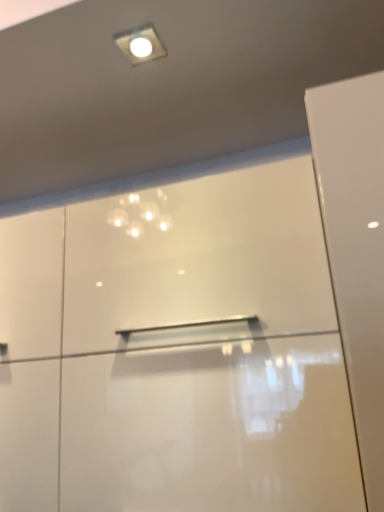
Where is `glossy white dresser at center`? glossy white dresser at center is located at coordinates (175, 352).

Image resolution: width=384 pixels, height=512 pixels. What do you see at coordinates (175, 352) in the screenshot? I see `glossy white dresser at center` at bounding box center [175, 352].

Image resolution: width=384 pixels, height=512 pixels. What do you see at coordinates (140, 44) in the screenshot? I see `white glossy droplight at upper center` at bounding box center [140, 44].

Measure the distance between point (x=133, y=33) and camera.

Point (x=133, y=33) and camera are 35.91 inches apart from each other.

Identify the location of white glossy droplight at upper center. [x=140, y=44].

Find the location of a particular element. The image size is (384, 512). glossy white dresser at center is located at coordinates (175, 352).

Is white glossy droplight at upper center to the right of glossy white dresser at center from the viewer's perspective?

Yes, white glossy droplight at upper center is to the right of glossy white dresser at center.

In the scene shown: Is white glossy droplight at upper center positioned in front of glossy white dresser at center?

No, it is behind glossy white dresser at center.

Based on the photo, which point is more forward, (137, 50) or (183, 377)?

The point (183, 377) is in front.

From the image's perspective, relative to glossy white dresser at center, is white glossy droplight at upper center above or below?

Clearly, from the image's perspective, white glossy droplight at upper center is above glossy white dresser at center.

From a real-world perspective, who is located higher, white glossy droplight at upper center or glossy white dresser at center?

white glossy droplight at upper center, from a real-world perspective.

Between white glossy droplight at upper center and glossy white dresser at center, which one has smaller width?

With smaller width is white glossy droplight at upper center.

Is white glossy droplight at upper center taller or shorter than glossy white dresser at center?

In the image, white glossy droplight at upper center appears to be shorter than glossy white dresser at center.

Between white glossy droplight at upper center and glossy white dresser at center, which one has larger size?

glossy white dresser at center.

Would you say white glossy droplight at upper center contains glossy white dresser at center?

No, glossy white dresser at center is not surrounded by white glossy droplight at upper center.

Is white glossy droplight at upper center in contact with glossy white dresser at center?

No, white glossy droplight at upper center is not next to glossy white dresser at center.

Could you tell me if white glossy droplight at upper center is facing glossy white dresser at center?

No, white glossy droplight at upper center is not oriented towards glossy white dresser at center.

This screenshot has width=384, height=512. I want to click on dresser to the left of white glossy droplight at upper center, so click(x=175, y=352).

Can you confirm if glossy white dresser at center is positioned to the right of white glossy droplight at upper center?

No.

Is the depth of glossy white dresser at center greater than that of white glossy droplight at upper center?

That is False.

Which is behind, point (319, 404) or point (149, 41)?

Positioned behind is point (149, 41).

From the image's perspective, is glossy white dresser at center positioned above or below white glossy droplight at upper center?

From the image's perspective, glossy white dresser at center appears below white glossy droplight at upper center.

From a real-world perspective, which object stands above the other?

white glossy droplight at upper center is physically above.

Considering the sizes of objects glossy white dresser at center and white glossy droplight at upper center in the image provided, who is thinner, glossy white dresser at center or white glossy droplight at upper center?

With smaller width is white glossy droplight at upper center.

Is glossy white dresser at center taller than white glossy droplight at upper center?

Indeed, glossy white dresser at center has a greater height compared to white glossy droplight at upper center.

Can you confirm if glossy white dresser at center is bigger than white glossy droplight at upper center?

Yes, glossy white dresser at center is bigger than white glossy droplight at upper center.

Would you say white glossy droplight at upper center is part of glossy white dresser at center's contents?

No, glossy white dresser at center does not contain white glossy droplight at upper center.

Can you see glossy white dresser at center touching white glossy droplight at upper center?

glossy white dresser at center and white glossy droplight at upper center are clearly separated.

Is glossy white dresser at center turned away from white glossy droplight at upper center?

No.

What's the angular difference between glossy white dresser at center and white glossy droplight at upper center's facing directions?

5.8 degrees separate the facing orientations of glossy white dresser at center and white glossy droplight at upper center.

Where is `droplight positioned vertically above the glossy white dresser at center (from a real-world perspective)`? Image resolution: width=384 pixels, height=512 pixels. droplight positioned vertically above the glossy white dresser at center (from a real-world perspective) is located at coordinates (140, 44).

Where is `droplight above the glossy white dresser at center (from the image's perspective)`? This screenshot has width=384, height=512. droplight above the glossy white dresser at center (from the image's perspective) is located at coordinates [x=140, y=44].

In order to click on dresser that appears on the left of white glossy droplight at upper center in this screenshot , I will do `click(175, 352)`.